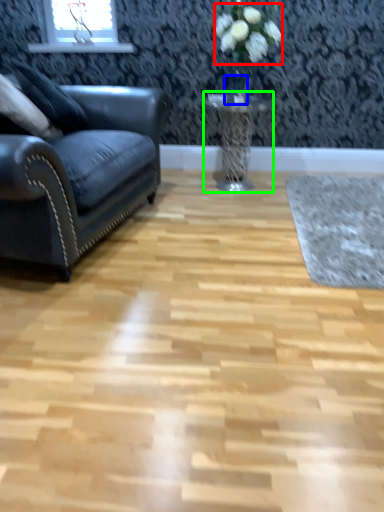
Question: Which object is the closest to the flower (highlighted by a red box)? Choose among these: glass vase (highlighted by a blue box) or table (highlighted by a green box).

Choices:
 (A) glass vase
 (B) table

Answer: (A)